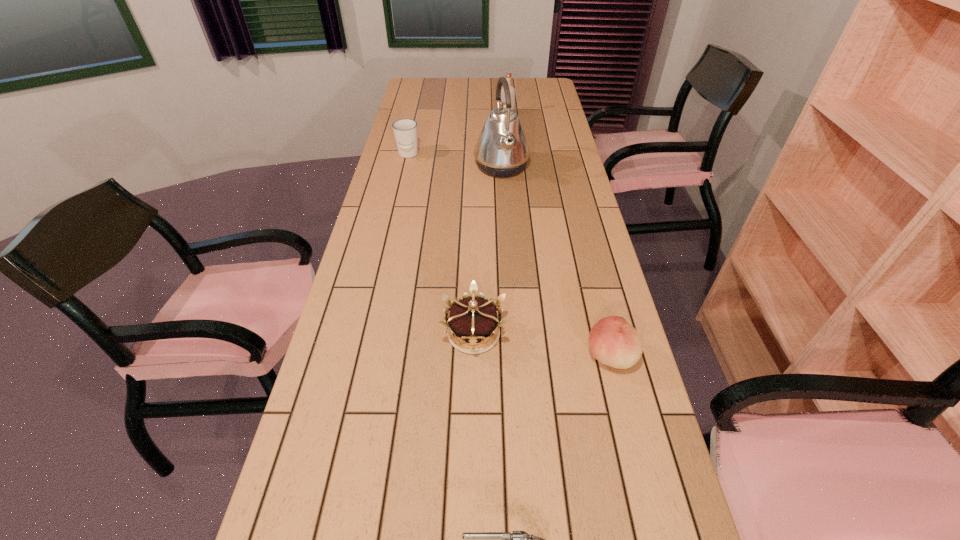
Locate an element on the screen. vacant area that lies between the kettle and the crown is located at coordinates (488, 250).

What are the coordinates of `unoccupied position between the leftmost object and the crown` in the screenshot? It's located at (441, 244).

I want to click on unoccupied position between the rightmost object and the crown, so click(542, 345).

At what (x,y) coordinates should I click in order to perform the action: click on free space between the peach and the crown. Please return your answer as a coordinate pair (x, y). The image size is (960, 540). Looking at the image, I should click on (542, 345).

You are a GUI agent. You are given a task and a screenshot of the screen. Output one action in this format:
    pyautogui.click(x=<x>, y=<y>)
    Task: Click on the vacant area between the crown and the rightmost object
    This screenshot has width=960, height=540.
    Given the screenshot: What is the action you would take?
    pyautogui.click(x=542, y=345)

Identify which object is located as the fifth nearest to the nearest object. Please provide its 2D coordinates. Your answer should be formatted as a tuple, i.e. [(x, y)], where the tuple contains the x and y coordinates of a point satisfying the conditions above.

[(508, 76)]

Identify the location of object that ranks as the fifth closest to the peach. The height and width of the screenshot is (540, 960). (508, 76).

I want to click on vacant space that satisfies the following two spatial constraints: 1. with a handle on the side of the leftmost object; 2. on the right side of the crown, so click(x=368, y=333).

The image size is (960, 540). I want to click on vacant region that satisfies the following two spatial constraints: 1. on the label of the vodka; 2. with a handle on the side of the leftmost object, so [511, 155].

Identify the location of vacant region that satisfies the following two spatial constraints: 1. on the back side of the tallest object; 2. on the left side of the crown. (476, 167).